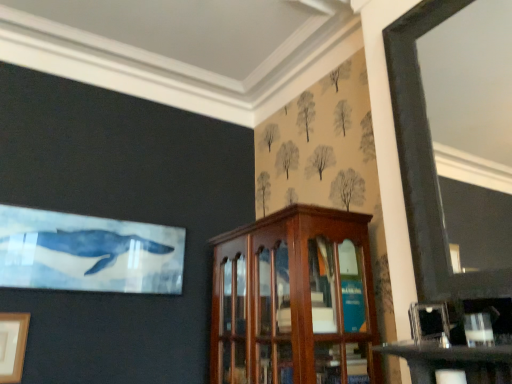
Question: Would you say wooden picture frame at lower left, acting as the 1th picture frame starting from the left, is part of metallic silver picture frame at lower right, the 1th picture frame viewed from the right,'s contents?

Choices:
 (A) yes
 (B) no

Answer: (B)

Question: Is metallic silver picture frame at lower right, which is the second picture frame in left-to-right order, positioned before wooden picture frame at lower left, which is the 2th picture frame in right-to-left order?

Choices:
 (A) no
 (B) yes

Answer: (B)

Question: Is metallic silver picture frame at lower right, which is the second picture frame in left-to-right order, wider than wooden picture frame at lower left, acting as the 1th picture frame starting from the left?

Choices:
 (A) yes
 (B) no

Answer: (A)

Question: From the image's perspective, does metallic silver picture frame at lower right, the 1th picture frame viewed from the right, appear higher than wooden picture frame at lower left, positioned as the 1th picture frame in bottom-to-top order?

Choices:
 (A) yes
 (B) no

Answer: (A)

Question: Does metallic silver picture frame at lower right, which ranks as the 1th picture frame in front-to-back order, appear on the left side of wooden picture frame at lower left, positioned as the 1th picture frame in back-to-front order?

Choices:
 (A) yes
 (B) no

Answer: (B)

Question: Is metallic silver picture frame at lower right, which is the 2th picture frame in bottom-to-top order, inside or outside of wooden picture frame at lower left, acting as the 2th picture frame starting from the front?

Choices:
 (A) inside
 (B) outside

Answer: (B)

Question: Does point (436, 331) appear closer or farther from the camera than point (3, 347)?

Choices:
 (A) closer
 (B) farther

Answer: (A)

Question: Based on their positions, is metallic silver picture frame at lower right, which ranks as the 1th picture frame in front-to-back order, located to the left or right of wooden picture frame at lower left, positioned as the 1th picture frame in back-to-front order?

Choices:
 (A) right
 (B) left

Answer: (A)

Question: From the image's perspective, is metallic silver picture frame at lower right, the 2th picture frame in the back-to-front sequence, located above or below wooden picture frame at lower left, acting as the 2th picture frame starting from the front?

Choices:
 (A) above
 (B) below

Answer: (A)

Question: Considering the positions of mahogany wood cabinet at center and wooden picture frame at lower left, acting as the 2th picture frame starting from the front, in the image, is mahogany wood cabinet at center taller or shorter than wooden picture frame at lower left, acting as the 2th picture frame starting from the front,?

Choices:
 (A) short
 (B) tall

Answer: (B)

Question: Is mahogany wood cabinet at center bigger or smaller than wooden picture frame at lower left, which is counted as the 2th picture frame, starting from the top?

Choices:
 (A) big
 (B) small

Answer: (A)

Question: Would you say mahogany wood cabinet at center is inside or outside wooden picture frame at lower left, positioned as the 1th picture frame in back-to-front order?

Choices:
 (A) inside
 (B) outside

Answer: (B)

Question: Is mahogany wood cabinet at center to the left or to the right of wooden picture frame at lower left, acting as the 2th picture frame starting from the front, in the image?

Choices:
 (A) right
 (B) left

Answer: (A)

Question: Looking at the image, does wooden picture frame at lower left, acting as the 1th picture frame starting from the left, seem bigger or smaller compared to mahogany wood cabinet at center?

Choices:
 (A) big
 (B) small

Answer: (B)

Question: Considering the relative positions of wooden picture frame at lower left, which is counted as the 2th picture frame, starting from the top, and mahogany wood cabinet at center in the image provided, is wooden picture frame at lower left, which is counted as the 2th picture frame, starting from the top, to the left or to the right of mahogany wood cabinet at center?

Choices:
 (A) left
 (B) right

Answer: (A)